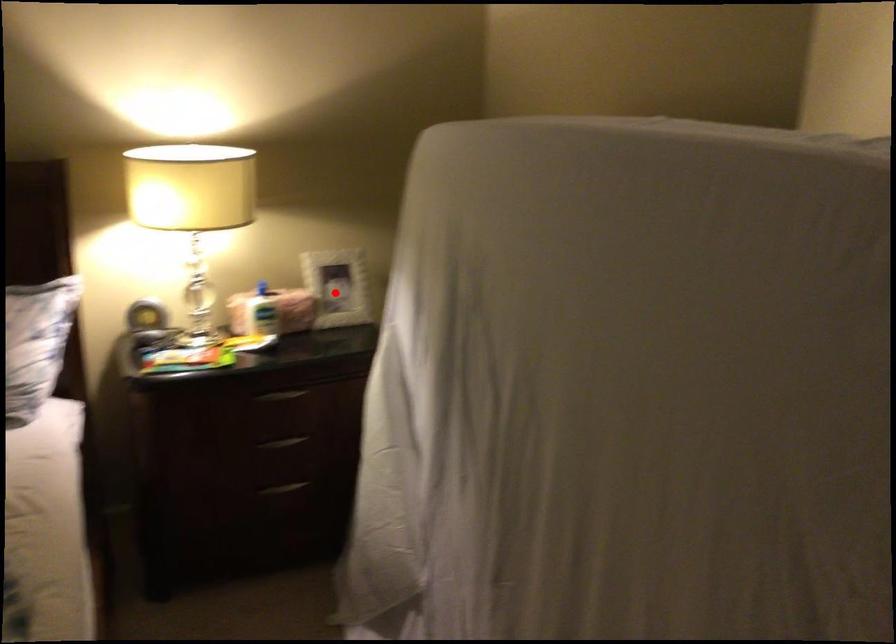
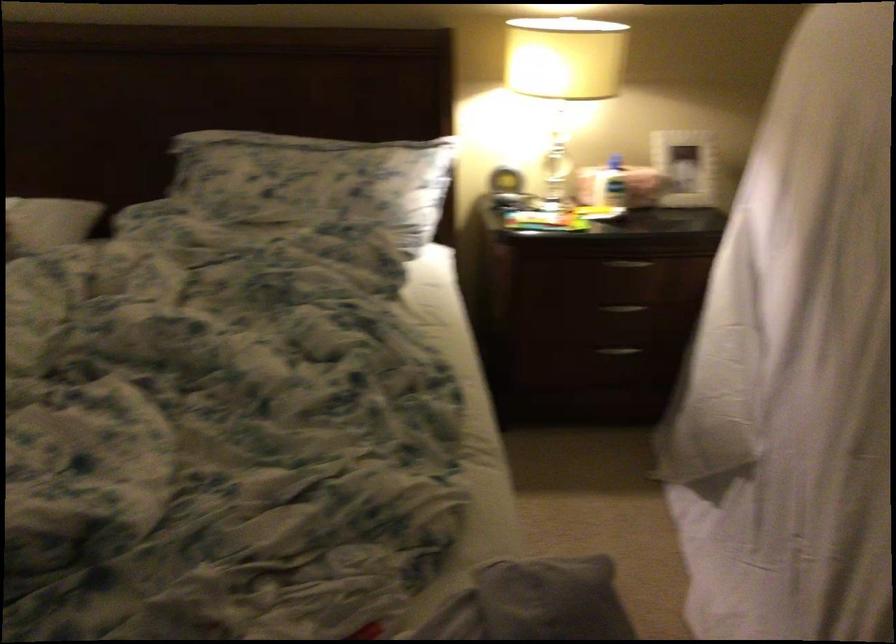
Find the pixel in the second image that matches the highlighted location in the first image.

(684, 167)